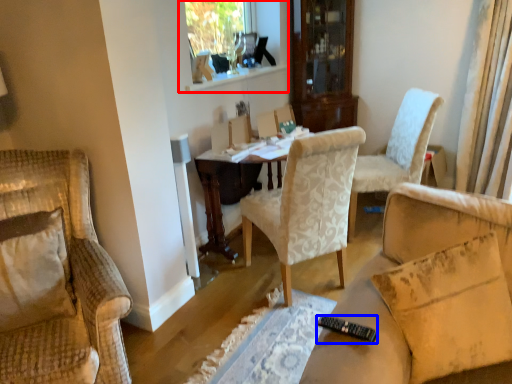
Question: Which of the following is the farthest to the observer, window frame (highlighted by a red box) or remote control (highlighted by a blue box)?

Choices:
 (A) window frame
 (B) remote control

Answer: (A)